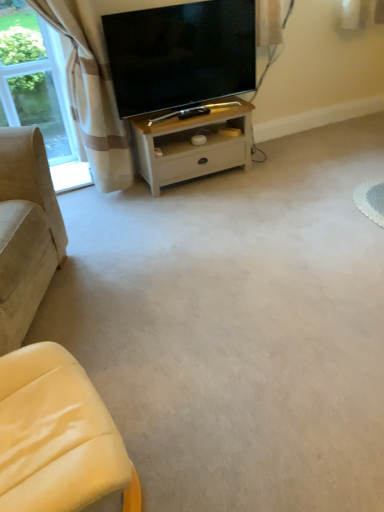
Image resolution: width=384 pixels, height=512 pixels. Find the location of `vacant space underneath matte black tv at upper center (from a real-world perspective)`. vacant space underneath matte black tv at upper center (from a real-world perspective) is located at coordinates (x=179, y=118).